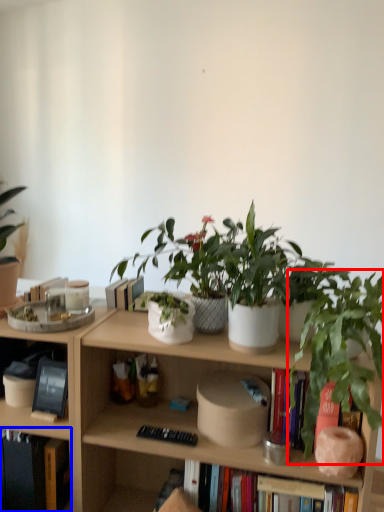
Question: Which object is closer to the camera taking this photo, houseplant (highlighted by a red box) or book (highlighted by a blue box)?

Choices:
 (A) houseplant
 (B) book

Answer: (A)